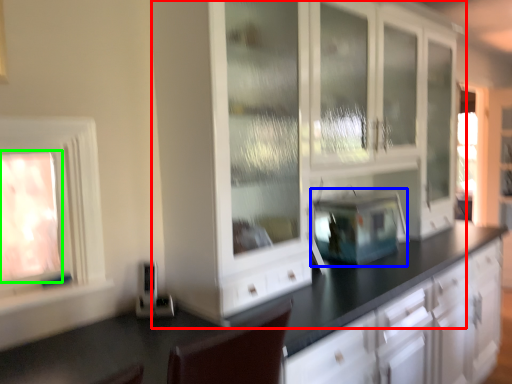
Question: Which object is the farthest from cabinetry (highlighted by a red box)? Choose among these: appliance (highlighted by a blue box) or window (highlighted by a green box).

Choices:
 (A) appliance
 (B) window

Answer: (B)